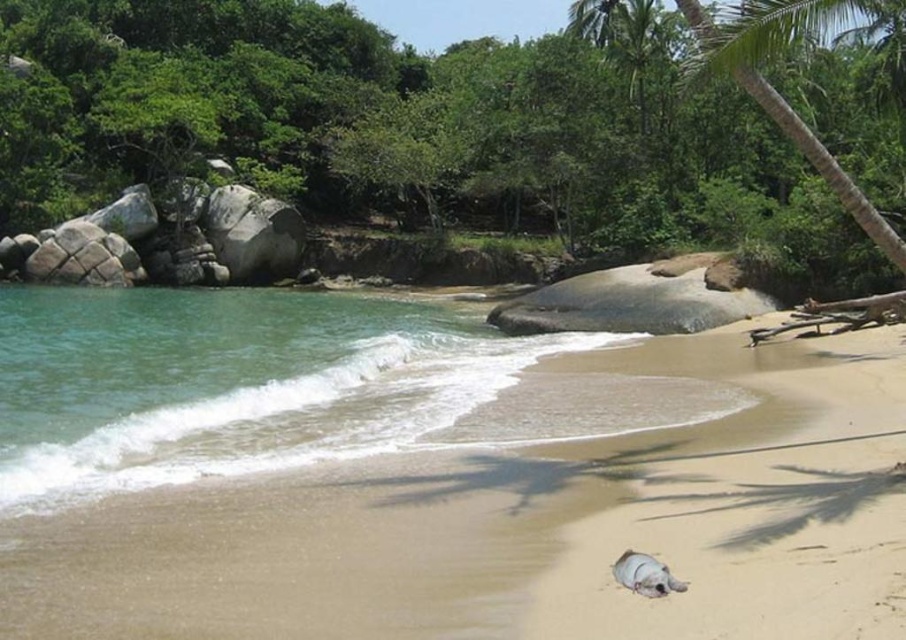
Who is lower down, clear water at lower left or gray matte turtle at lower center?

gray matte turtle at lower center is lower down.

Is clear water at lower left closer to camera compared to gray matte turtle at lower center?

No, clear water at lower left is further to the viewer.

The width and height of the screenshot is (906, 640). What do you see at coordinates (230, 381) in the screenshot?
I see `clear water at lower left` at bounding box center [230, 381].

Locate an element on the screen. clear water at lower left is located at coordinates (230, 381).

Does light brown sand at lower center have a larger size compared to clear water at lower left?

No.

Is light brown sand at lower center wider than clear water at lower left?

No, light brown sand at lower center is not wider than clear water at lower left.

Where is `light brown sand at lower center`? Image resolution: width=906 pixels, height=640 pixels. light brown sand at lower center is located at coordinates (502, 506).

What are the coordinates of `light brown sand at lower center` in the screenshot? It's located at 502,506.

Does green leafy palm tree at upper right come behind gray matte turtle at lower center?

Yes.

Which of these two, green leafy palm tree at upper right or gray matte turtle at lower center, stands taller?

Standing taller between the two is green leafy palm tree at upper right.

Who is more distant from viewer, (683, 1) or (657, 586)?

Positioned behind is point (683, 1).

I want to click on green leafy palm tree at upper right, so click(823, 163).